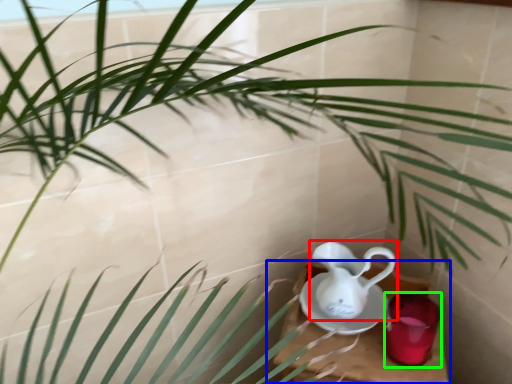
Question: Which is farther away from jug (highlighted by a red box)? table (highlighted by a blue box) or tableware (highlighted by a green box)?

Choices:
 (A) table
 (B) tableware

Answer: (B)